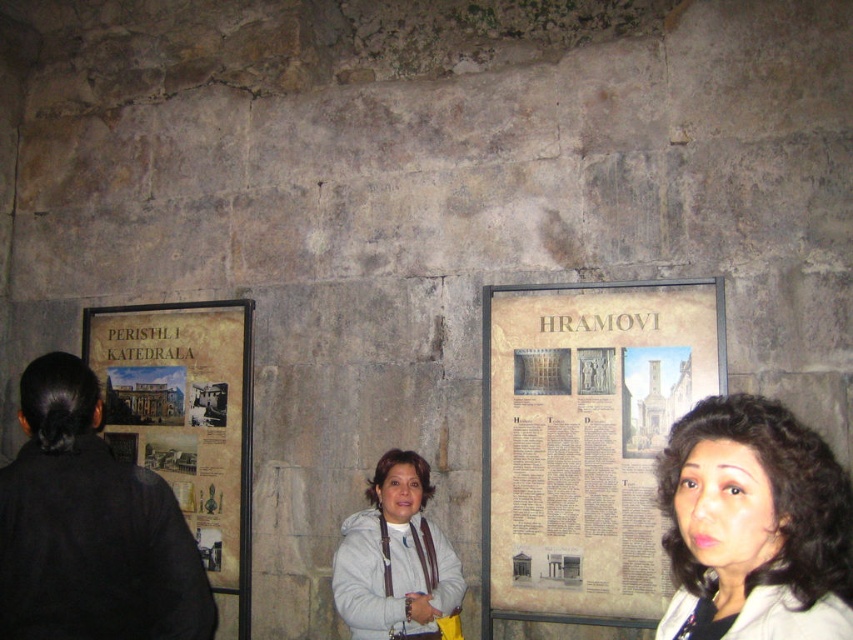
You are a tour guide carrying a 3.5 feet wide box and want to place it between the black fabric at left and the white fleece jacket at center. Is there enough space?

The distance between the black fabric at left and the white fleece jacket at center is 4.33 feet, which is wider than the box, so yes, there is enough space.

You are an archaeologist examining the wall displays in this historical site. You notice the beige paper poster at center right and the dark brown hair at center. Which object is wider?

The beige paper poster at center right is wider than the dark brown hair at center, as its width surpasses the latter.